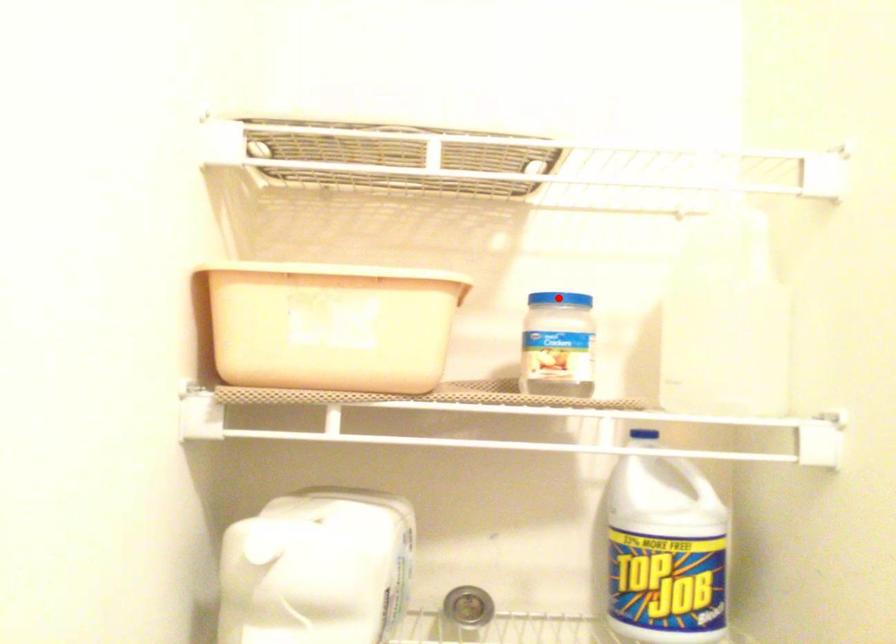
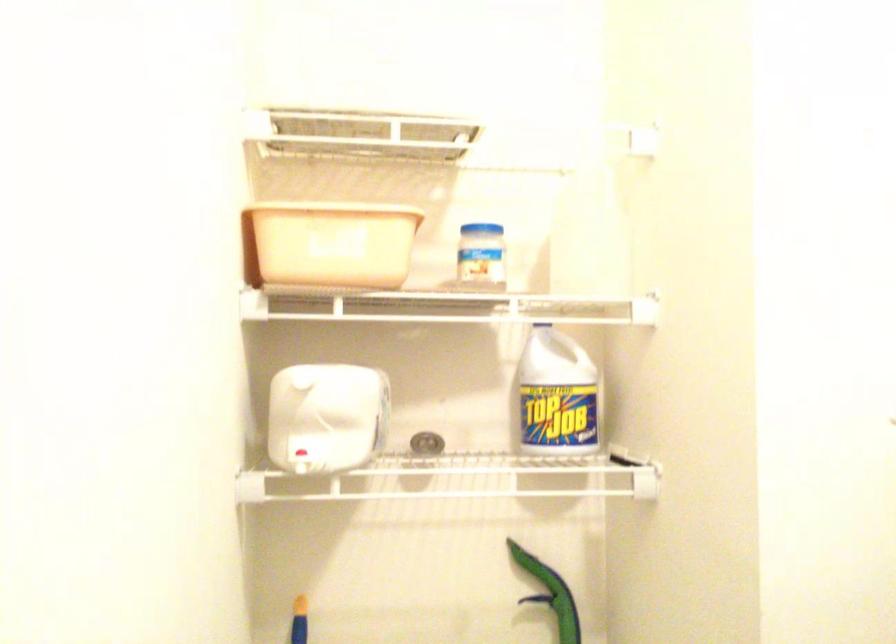
Question: I am providing you with two images of the same scene from different viewpoints. In image1, a red point is highlighted. Considering the same 3D point in image2, which of the following is correct?

Choices:
 (A) It is closer
 (B) It is farther

Answer: (B)